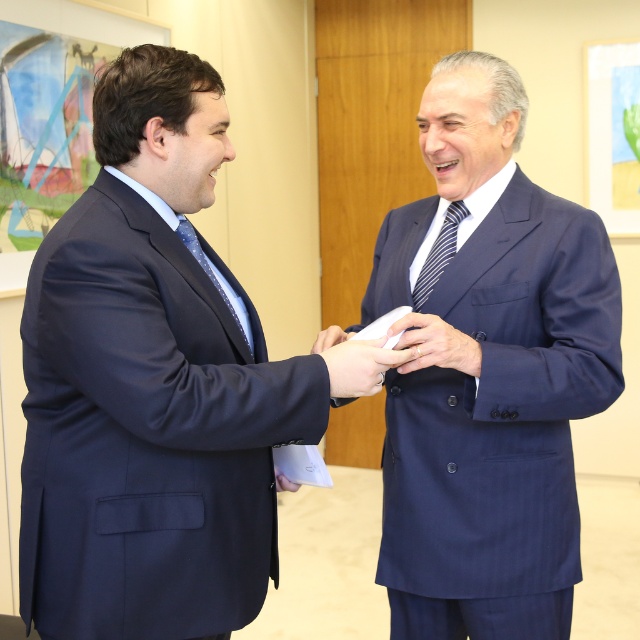
Question: Observing the image, what is the correct spatial positioning of blue pinstripe suit at center in reference to matte blue suit at center?

Choices:
 (A) left
 (B) right

Answer: (B)

Question: Does blue pinstripe suit at center have a greater width compared to matte blue suit at center?

Choices:
 (A) yes
 (B) no

Answer: (A)

Question: Which point appears closest to the camera in this image?

Choices:
 (A) (464, 483)
 (B) (200, 557)

Answer: (B)

Question: Among these objects, which one is farthest from the camera?

Choices:
 (A) blue pinstripe suit at center
 (B) striped fabric tie at center
 (C) white paper at center

Answer: (B)

Question: Which point is farther from the camera taking this photo?

Choices:
 (A) (451, 220)
 (B) (413, 349)
 (C) (179, 218)
 (D) (349, 352)

Answer: (A)

Question: Is white paper at center bigger than striped fabric tie at center?

Choices:
 (A) no
 (B) yes

Answer: (B)